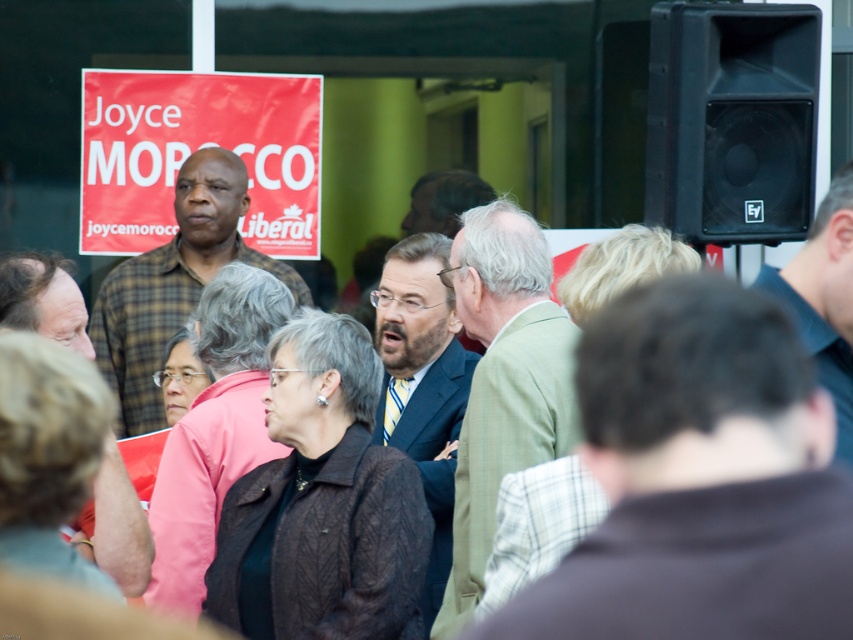
Can you confirm if black plastic speaker at upper right is wider than red plastic sign at center?

Incorrect, black plastic speaker at upper right's width does not surpass red plastic sign at center's.

Consider the image. Is black plastic speaker at upper right further to camera compared to red plastic sign at center?

No.

The image size is (853, 640). I want to click on black plastic speaker at upper right, so click(730, 122).